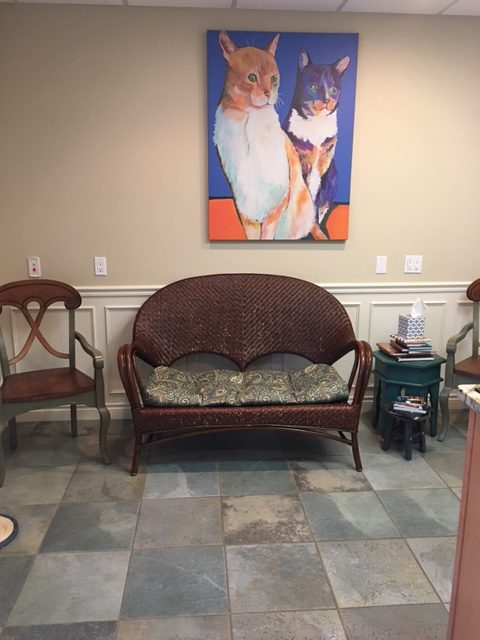
Image resolution: width=480 pixels, height=640 pixels. I want to click on cushion, so click(x=219, y=385).